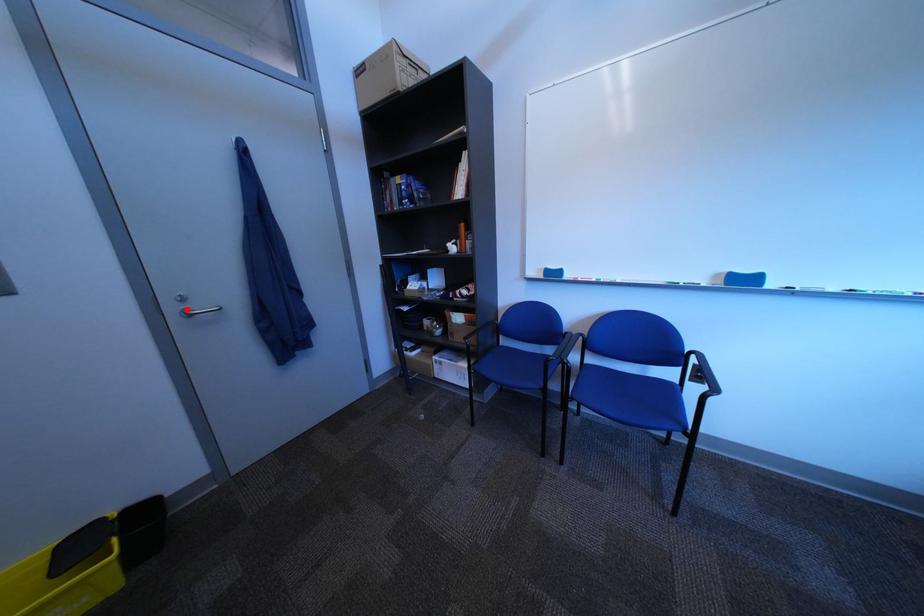
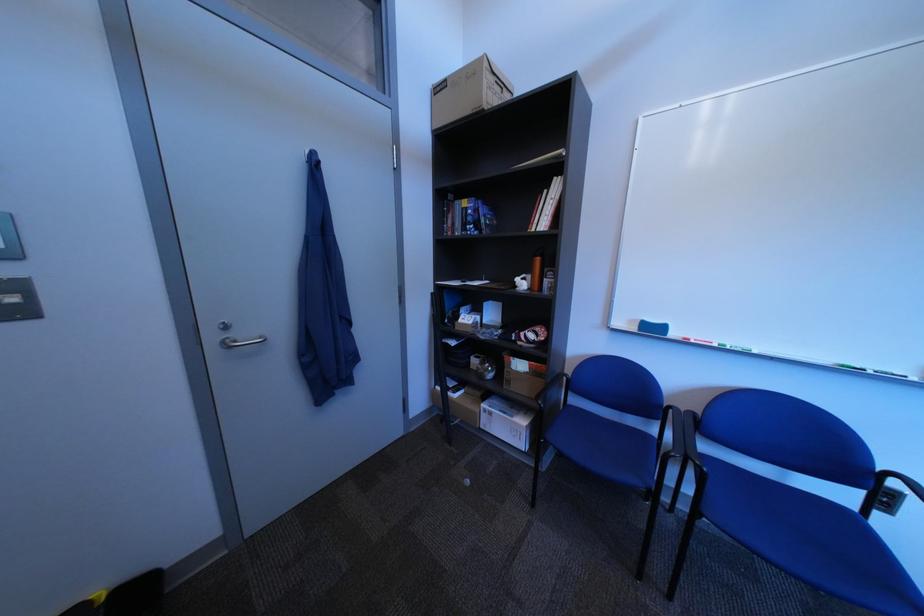
In the second image, find the point that corresponds to the highlighted location in the first image.

(226, 339)